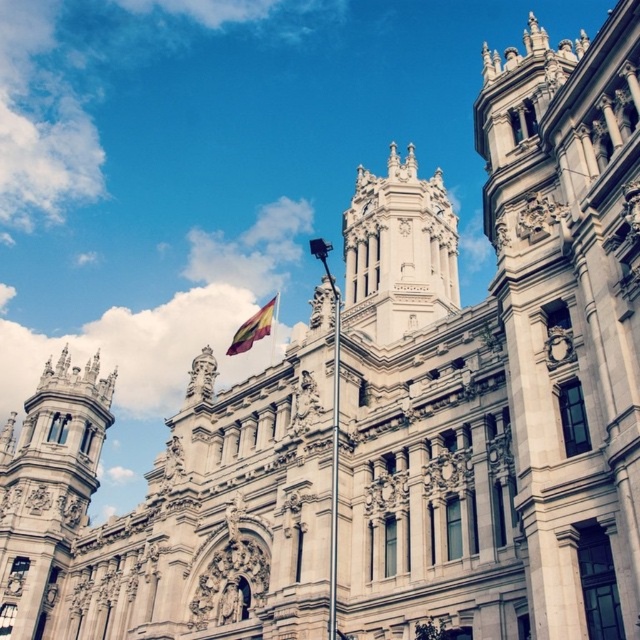
Question: Estimate the real-world distances between objects in this image. Which object is closer to the polyester flag at center?

Choices:
 (A) metallic flag pole at center
 (B) white stone tower at left

Answer: (B)

Question: Among these points, which one is farthest from the camera?

Choices:
 (A) (449, 240)
 (B) (275, 301)
 (C) (109, 396)
 (D) (333, 486)

Answer: (B)

Question: Is white stone tower at center wider than metallic flag pole at center?

Choices:
 (A) yes
 (B) no

Answer: (A)

Question: Which object is closer to the camera taking this photo?

Choices:
 (A) metallic flag pole at center
 (B) white stone tower at center

Answer: (A)

Question: Can you confirm if white stone tower at center is positioned to the right of metallic flag pole at center?

Choices:
 (A) no
 (B) yes

Answer: (B)

Question: Is white stone tower at left above white stone tower at center?

Choices:
 (A) yes
 (B) no

Answer: (B)